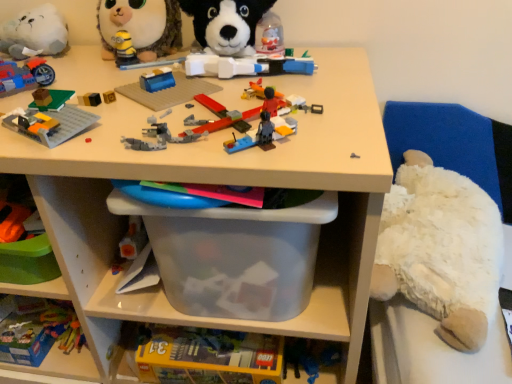
You are a GUI agent. You are given a task and a screenshot of the screen. Output one action in this format:
    pyautogui.click(x=<x>, y=<y>)
    Task: Click on the free space to the back side of translucent plastic airplane at center, arranged as the 3th toy when viewed from the right
    
    Given the screenshot: What is the action you would take?
    pyautogui.click(x=241, y=77)